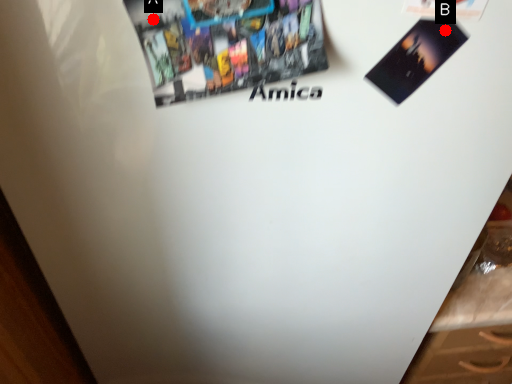
Question: Two points are circled on the image, labeled by A and B beside each circle. Among these points, which one is nearest to the camera?

Choices:
 (A) A is closer
 (B) B is closer

Answer: (A)